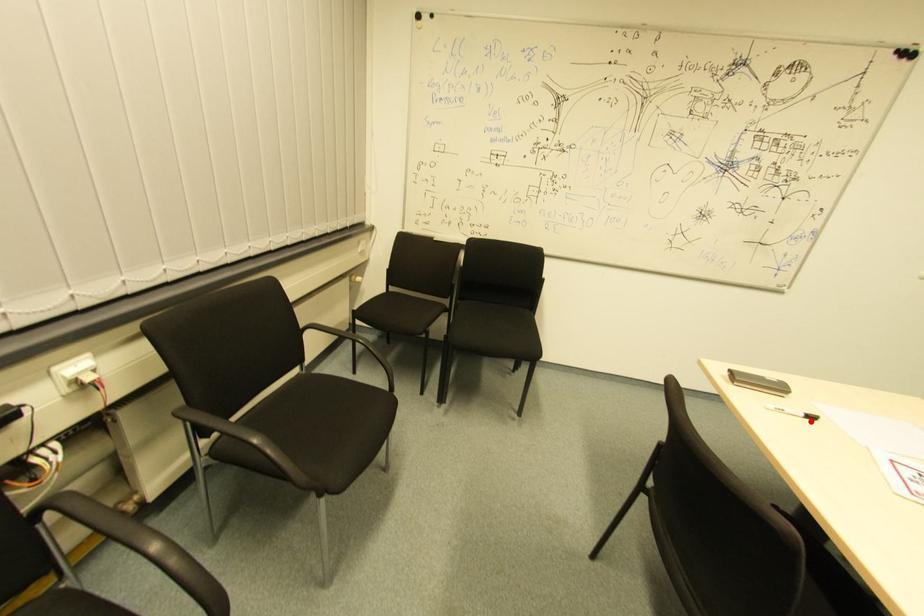
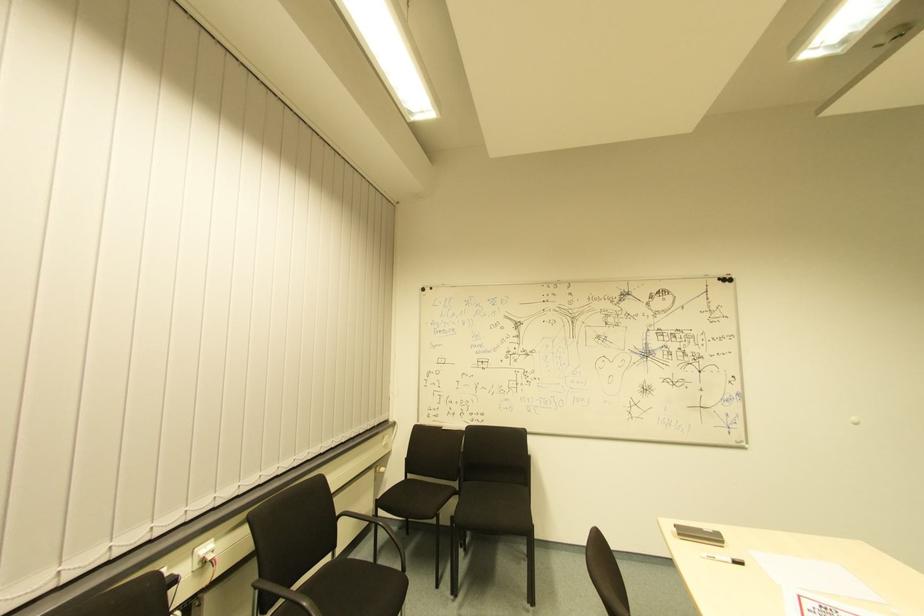
Where in the second image is the point corresponding to the highlighted location from the first image?

(737, 565)